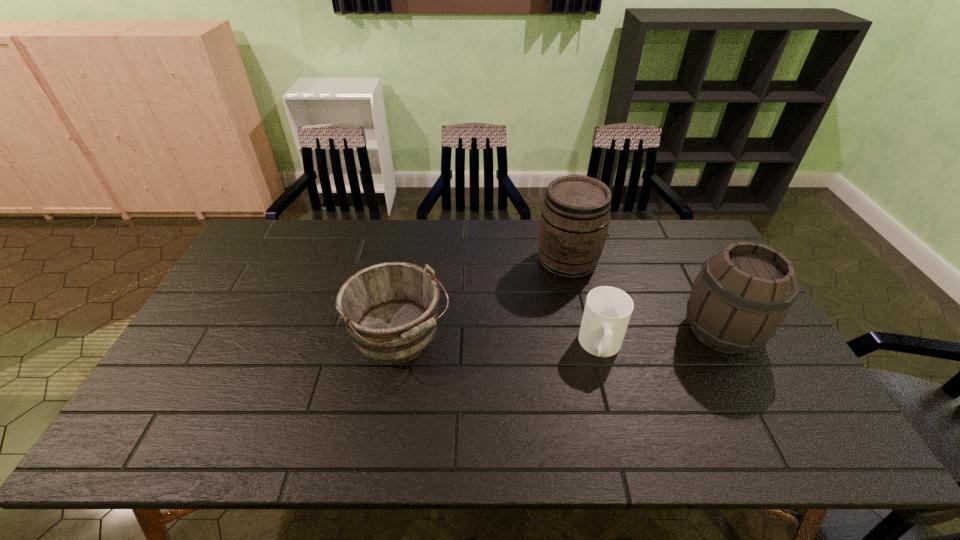
The image size is (960, 540). I want to click on vacant point located between the farthest wine bucket and the mug, so click(x=585, y=304).

I want to click on free spot between the mug and the leftmost object, so click(500, 341).

The image size is (960, 540). Identify the location of empty space that is in between the rightmost wine bucket and the farthest wine bucket. (644, 297).

The width and height of the screenshot is (960, 540). What are the coordinates of `vacant region between the second wine bucket from right to left and the mug` in the screenshot? It's located at (585, 304).

Image resolution: width=960 pixels, height=540 pixels. Find the location of `free point between the second wine bucket from left to right and the rightmost wine bucket`. free point between the second wine bucket from left to right and the rightmost wine bucket is located at coordinates (644, 297).

Where is `unoccupied position between the farthest object and the leftmost wine bucket`? unoccupied position between the farthest object and the leftmost wine bucket is located at coordinates (484, 299).

Where is `blank region between the second wine bucket from right to left and the shortest wine bucket`? blank region between the second wine bucket from right to left and the shortest wine bucket is located at coordinates (484, 299).

Where is `object that ranks as the second closest to the shortest wine bucket`? The width and height of the screenshot is (960, 540). object that ranks as the second closest to the shortest wine bucket is located at coordinates (607, 312).

Locate an element on the screen. object that ranks as the third closest to the rightmost object is located at coordinates (390, 310).

What are the coordinates of `wine bucket that is the second closest to the farthest wine bucket` in the screenshot? It's located at (390, 310).